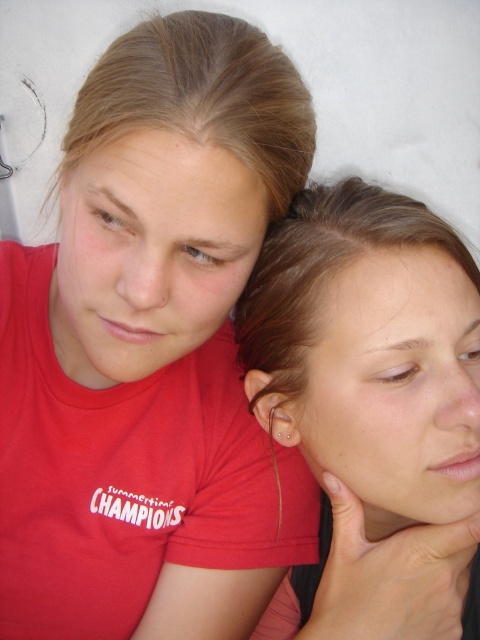
Is matte red t-shirt at upper left bigger than brown hair at upper right?

Indeed, matte red t-shirt at upper left has a larger size compared to brown hair at upper right.

Who is more forward, (12, 524) or (276, 625)?

Point (12, 524) is more forward.

Image resolution: width=480 pixels, height=640 pixels. Identify the location of matte red t-shirt at upper left. (152, 349).